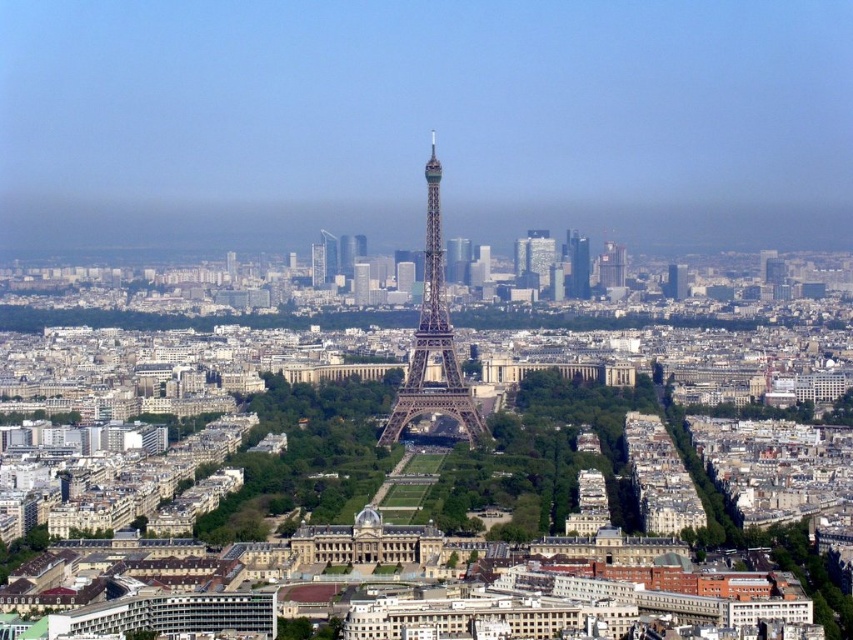
You are a tourist standing at the base of the painted steel eiffel tower at center and want to take a photo that includes both it and the smooth glass skyscraper at center. Which object will appear taller in the photo?

The painted steel eiffel tower at center will appear taller in the photo because it has a greater height compared to the smooth glass skyscraper at center.

Based on the photo, you are standing in the park in front of the Eiffel Tower. You want to reach the point marked at coordinates point (437, 314). If your walking speed is 3 feet per second, how many seconds will it take you to reach that point?

The point (437, 314) is 1447.99 feet away from the viewer. At a walking speed of 3 feet per second, it would take approximately 482.66 seconds to reach that point.